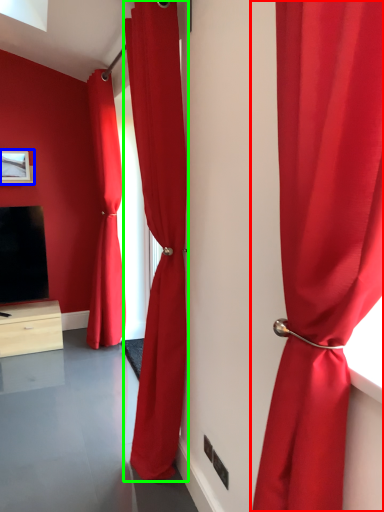
Question: Based on their relative distances, which object is farther from curtain (highlighted by a red box)? Choose from picture frame (highlighted by a blue box) and curtain (highlighted by a green box).

Choices:
 (A) picture frame
 (B) curtain

Answer: (A)